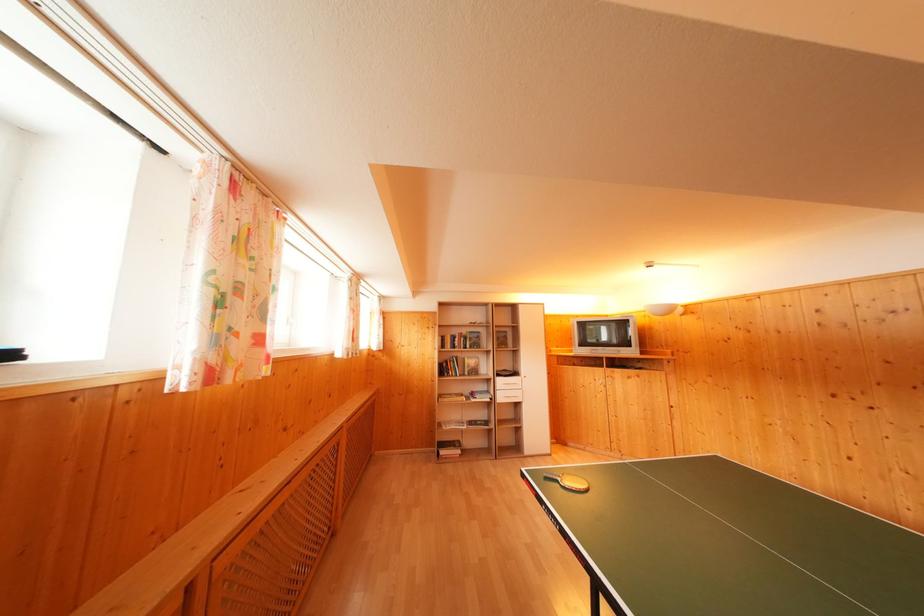
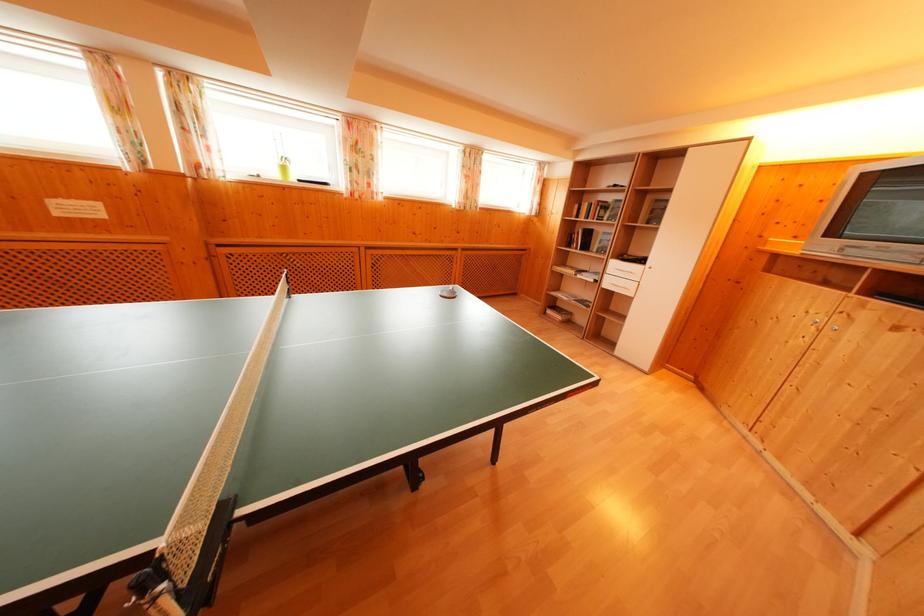
The point at [503,392] is marked in the first image. Where is the corresponding point in the second image?

(614, 276)